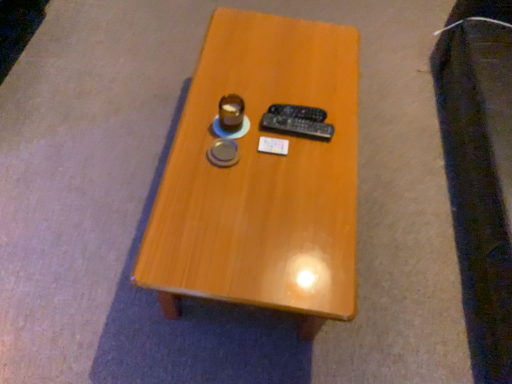
Measure the distance between point (x=301, y=131) and camera.

Point (x=301, y=131) and camera are 1.24 meters apart.

How much space does black plastic remote control at center, arranged as the 1th remote control when viewed from the back, occupy vertically?

3.15 centimeters.

Describe the element at coordinates (262, 177) in the screenshot. Image resolution: width=512 pixels, height=384 pixels. I see `wooden table at center` at that location.

This screenshot has height=384, width=512. What are the coordinates of `black plastic remote control at center, arranged as the first remote control when viewed from the front` in the screenshot? It's located at (296, 126).

Considering the relative sizes of wooden table at center and black plastic remote control at center, which is counted as the second remote control, starting from the back, in the image provided, is wooden table at center shorter than black plastic remote control at center, which is counted as the second remote control, starting from the back,?

No, wooden table at center is not shorter than black plastic remote control at center, which is counted as the second remote control, starting from the back.

Can you tell me how much wooden table at center and black plastic remote control at center, arranged as the first remote control when viewed from the front, differ in facing direction?

179 degrees separate the facing orientations of wooden table at center and black plastic remote control at center, arranged as the first remote control when viewed from the front.

From a real-world perspective, is wooden table at center located higher than black plastic remote control at center, arranged as the first remote control when viewed from the front?

No.

How far apart are wooden table at center and black plastic remote control at center, arranged as the first remote control when viewed from the front?

A distance of 10.26 inches exists between wooden table at center and black plastic remote control at center, arranged as the first remote control when viewed from the front.

Who is taller, black plastic remote control at center, which is counted as the second remote control, starting from the back, or wooden table at center?

Standing taller between the two is wooden table at center.

Choose the correct answer: Is black plastic remote control at center, arranged as the first remote control when viewed from the front, inside wooden table at center or outside it?

black plastic remote control at center, arranged as the first remote control when viewed from the front, is spatially positioned inside wooden table at center.

Which is closer to the camera, (333, 129) or (343, 161)?

Positioned in front is point (343, 161).

Between black plastic remote control at center, which is counted as the second remote control, starting from the back, and black plastic remote control at center, marked as the second remote control in a front-to-back arrangement, which one has larger size?

black plastic remote control at center, which is counted as the second remote control, starting from the back, is bigger.

How far apart are black plastic remote control at center, which is counted as the second remote control, starting from the back, and black plastic remote control at center, arranged as the 1th remote control when viewed from the back?

A distance of 3.11 centimeters exists between black plastic remote control at center, which is counted as the second remote control, starting from the back, and black plastic remote control at center, arranged as the 1th remote control when viewed from the back.

Would you consider black plastic remote control at center, which is counted as the second remote control, starting from the back, to be distant from black plastic remote control at center, arranged as the 1th remote control when viewed from the back?

That's not correct — black plastic remote control at center, which is counted as the second remote control, starting from the back, is a little close to black plastic remote control at center, arranged as the 1th remote control when viewed from the back.

In order to click on remote control that is above the black plastic remote control at center, which is counted as the second remote control, starting from the back (from a real-world perspective) in this screenshot , I will do `click(298, 112)`.

Is wooden table at center spatially inside black plastic remote control at center, arranged as the 1th remote control when viewed from the back, or outside of it?

The correct answer is: outside.

Are wooden table at center and black plastic remote control at center, marked as the second remote control in a front-to-back arrangement, beside each other?

No.

Consider the image. From the image's perspective, which one is positioned lower, wooden table at center or black plastic remote control at center, marked as the second remote control in a front-to-back arrangement?

wooden table at center appears lower in the image.

Looking at this image, which of these two, wooden table at center or black plastic remote control at center, arranged as the 1th remote control when viewed from the back, stands shorter?

black plastic remote control at center, arranged as the 1th remote control when viewed from the back.

Is black plastic remote control at center, marked as the second remote control in a front-to-back arrangement, wider than wooden table at center?

In fact, black plastic remote control at center, marked as the second remote control in a front-to-back arrangement, might be narrower than wooden table at center.

Is the position of black plastic remote control at center, marked as the second remote control in a front-to-back arrangement, more distant than that of wooden table at center?

That is True.

From the image's perspective, who appears lower, black plastic remote control at center, arranged as the 1th remote control when viewed from the back, or wooden table at center?

wooden table at center appears lower in the image.

Based on the photo, from a real-world perspective, is matte brown coffee cup at center physically above black plastic remote control at center, arranged as the 1th remote control when viewed from the back?

Yes, from a real-world perspective, matte brown coffee cup at center is on top of black plastic remote control at center, arranged as the 1th remote control when viewed from the back.

Considering the points (237, 118) and (291, 114), which point is in front, point (237, 118) or point (291, 114)?

The point (237, 118) is closer.

Is the surface of matte brown coffee cup at center in direct contact with black plastic remote control at center, marked as the second remote control in a front-to-back arrangement?

There is a gap between matte brown coffee cup at center and black plastic remote control at center, marked as the second remote control in a front-to-back arrangement.

Which object is positioned more to the left, matte brown coffee cup at center or black plastic remote control at center, marked as the second remote control in a front-to-back arrangement?

matte brown coffee cup at center.

From the image's perspective, is matte brown coffee cup at center positioned above or below wooden table at center?

Based on their image positions, matte brown coffee cup at center is located above wooden table at center.

From a real-world perspective, is matte brown coffee cup at center physically above wooden table at center?

Yes, from a real-world perspective, matte brown coffee cup at center is over wooden table at center

Find the location of a particular element. This screenshot has width=512, height=384. table below the matte brown coffee cup at center (from the image's perspective) is located at coordinates (262, 177).

Can you tell me how much matte brown coffee cup at center and wooden table at center differ in facing direction?

They differ by 180 degrees in their facing directions.

The image size is (512, 384). I want to click on table on the left of black plastic remote control at center, which is counted as the second remote control, starting from the back, so click(262, 177).

From the wooden table at center, count 2nd remote control to the right and point to it. Please provide its 2D coordinates.

[(296, 126)]

When comparing their distances from wooden table at center, does black plastic remote control at center, which is counted as the second remote control, starting from the back, or black plastic remote control at center, arranged as the 1th remote control when viewed from the back, seem further?

black plastic remote control at center, arranged as the 1th remote control when viewed from the back, is positioned further to the anchor wooden table at center.

Looking at the image, which one is located closer to matte brown coffee cup at center, black plastic remote control at center, arranged as the first remote control when viewed from the front, or wooden table at center?

black plastic remote control at center, arranged as the first remote control when viewed from the front, lies closer to matte brown coffee cup at center than the other object.

Looking at the image, which one is located further to black plastic remote control at center, arranged as the 1th remote control when viewed from the back, black plastic remote control at center, which is counted as the second remote control, starting from the back, or wooden table at center?

wooden table at center lies further to black plastic remote control at center, arranged as the 1th remote control when viewed from the back, than the other object.

Estimate the real-world distances between objects in this image. Which object is closer to black plastic remote control at center, marked as the second remote control in a front-to-back arrangement, wooden table at center or matte brown coffee cup at center?

matte brown coffee cup at center is positioned closer to the anchor black plastic remote control at center, marked as the second remote control in a front-to-back arrangement.

Considering their positions, is black plastic remote control at center, arranged as the 1th remote control when viewed from the back, positioned closer to black plastic remote control at center, arranged as the first remote control when viewed from the front, than wooden table at center?

black plastic remote control at center, arranged as the 1th remote control when viewed from the back, lies closer to black plastic remote control at center, arranged as the first remote control when viewed from the front, than the other object.

Which object lies nearer to the anchor point wooden table at center, black plastic remote control at center, marked as the second remote control in a front-to-back arrangement, or black plastic remote control at center, arranged as the first remote control when viewed from the front?

The object closer to wooden table at center is black plastic remote control at center, arranged as the first remote control when viewed from the front.

When comparing their distances from black plastic remote control at center, which is counted as the second remote control, starting from the back, does matte brown coffee cup at center or wooden table at center seem closer?

Among the two, matte brown coffee cup at center is located nearer to black plastic remote control at center, which is counted as the second remote control, starting from the back.

In the scene shown: Based on their spatial positions, is wooden table at center or black plastic remote control at center, arranged as the 1th remote control when viewed from the back, closer to black plastic remote control at center, arranged as the first remote control when viewed from the front?

black plastic remote control at center, arranged as the 1th remote control when viewed from the back, is closer to black plastic remote control at center, arranged as the first remote control when viewed from the front.

The image size is (512, 384). What are the coordinates of `coffee cup between wooden table at center and black plastic remote control at center, arranged as the first remote control when viewed from the front, along the z-axis` in the screenshot? It's located at (231, 112).

Image resolution: width=512 pixels, height=384 pixels. What are the coordinates of `remote control situated between matte brown coffee cup at center and black plastic remote control at center, which is counted as the second remote control, starting from the back, from left to right` in the screenshot? It's located at (298, 112).

The width and height of the screenshot is (512, 384). What are the coordinates of `coffee cup between wooden table at center and black plastic remote control at center, arranged as the 1th remote control when viewed from the back, from front to back` in the screenshot? It's located at tap(231, 112).

You are a GUI agent. You are given a task and a screenshot of the screen. Output one action in this format:
    pyautogui.click(x=<x>, y=<y>)
    Task: Click on the remote control positioned between wooden table at center and black plastic remote control at center, marked as the second remote control in a front-to-back arrangement, from near to far
    
    Given the screenshot: What is the action you would take?
    pyautogui.click(x=296, y=126)